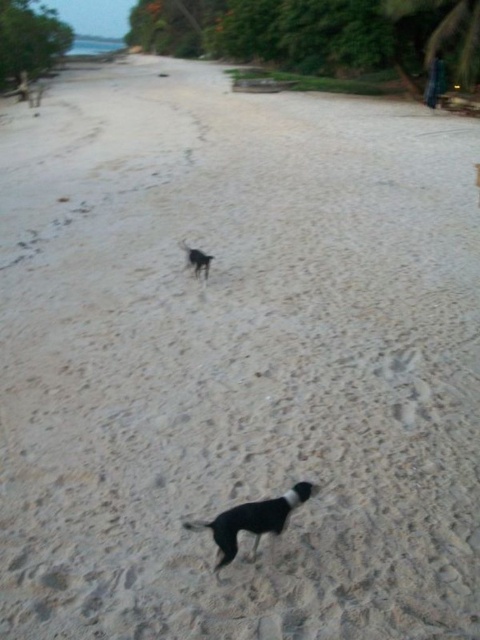
You are a photographer standing on the beach and want to take a photo that includes both the black fur dog at center and the black matte dog at center. Given that your camera has a maximum focus range of 10 feet, will you be able to capture both dogs in focus without moving?

The black fur dog at center is 10.43 feet away from the black matte dog at center. Since the distance between them exceeds the camera maximum focus range of 10 feet, you cannot capture both dogs in focus without moving.

You are a photographer trying to capture both the black fur dog at center and the black matte dog at center in the same frame. Which dog should you focus on first to ensure both are in focus?

The black fur dog at center is positioned under the black matte dog at center, so you should focus on the black matte dog at center first to ensure both are in focus.

Consider the image. You are standing on the beach and want to toss a ball to the black fur dog at center. If your throwing range is 2 meters, will you be able to reach it?

The distance between you and the black fur dog at center is 2.16 meters, which is slightly beyond your 2 meter throwing range. You won